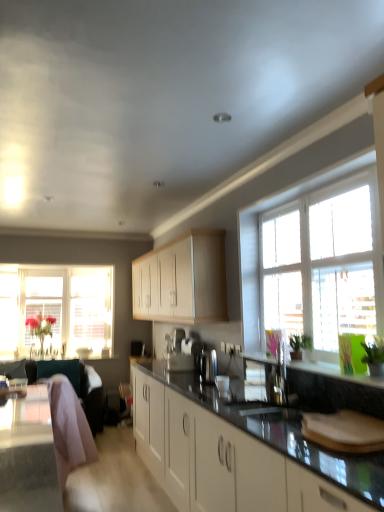
Question: Would you consider light wood cabinet at center to be distant from satin silver sink at center?

Choices:
 (A) yes
 (B) no

Answer: (A)

Question: From a real-world perspective, is light wood cabinet at center positioned over satin silver sink at center based on gravity?

Choices:
 (A) yes
 (B) no

Answer: (A)

Question: From the image's perspective, is light wood cabinet at center under satin silver sink at center?

Choices:
 (A) yes
 (B) no

Answer: (B)

Question: Does light wood cabinet at center have a lesser height compared to satin silver sink at center?

Choices:
 (A) yes
 (B) no

Answer: (B)

Question: Considering the relative positions of light wood cabinet at center and satin silver sink at center in the image provided, is light wood cabinet at center to the left of satin silver sink at center from the viewer's perspective?

Choices:
 (A) no
 (B) yes

Answer: (B)

Question: Can you confirm if light wood cabinet at center is thinner than satin silver sink at center?

Choices:
 (A) yes
 (B) no

Answer: (B)

Question: From a real-world perspective, is translucent glass vase at left, the 2th window in the right-to-left sequence, positioned under satin silver sink at center based on gravity?

Choices:
 (A) no
 (B) yes

Answer: (A)

Question: Considering the relative sizes of translucent glass vase at left, the 2th window positioned from the front, and satin silver sink at center in the image provided, is translucent glass vase at left, the 2th window positioned from the front, thinner than satin silver sink at center?

Choices:
 (A) yes
 (B) no

Answer: (B)

Question: Is translucent glass vase at left, the 2th window positioned from the front, smaller than satin silver sink at center?

Choices:
 (A) yes
 (B) no

Answer: (B)

Question: Does translucent glass vase at left, the 2th window positioned from the front, contain satin silver sink at center?

Choices:
 (A) yes
 (B) no

Answer: (B)

Question: From a real-world perspective, is translucent glass vase at left, the 2th window in the right-to-left sequence, on top of satin silver sink at center?

Choices:
 (A) yes
 (B) no

Answer: (A)

Question: Is translucent glass vase at left, arranged as the first window when viewed from the back, at the left side of satin silver sink at center?

Choices:
 (A) no
 (B) yes

Answer: (B)

Question: Is light wood cabinet at center closer to the viewer compared to pink fabric swivel chair at lower left, acting as the 2th swivel chair starting from the front?

Choices:
 (A) no
 (B) yes

Answer: (B)